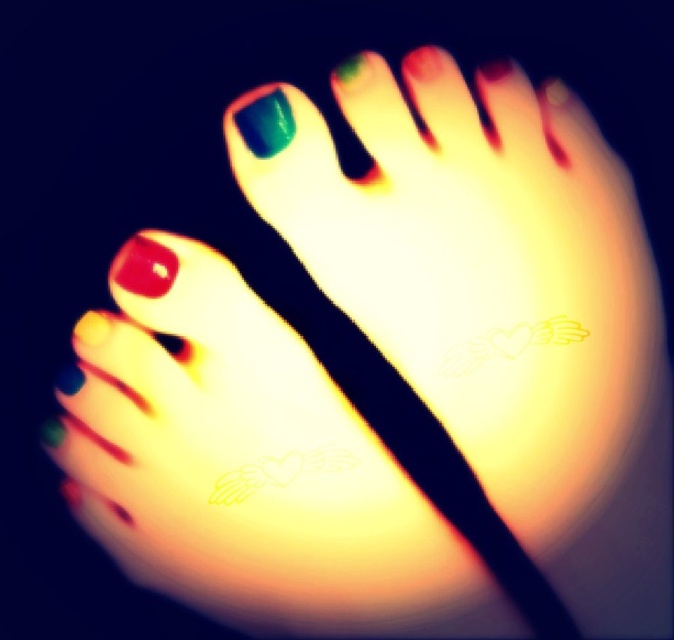
Is matte red nail at center bigger than shiny red nail at lower left?

Indeed, matte red nail at center has a larger size compared to shiny red nail at lower left.

Does matte red nail at center appear under shiny red nail at lower left?

Incorrect, matte red nail at center is not positioned below shiny red nail at lower left.

The image size is (674, 640). What do you see at coordinates (144, 266) in the screenshot?
I see `matte red nail at center` at bounding box center [144, 266].

Where is `matte red nail at center`? The width and height of the screenshot is (674, 640). matte red nail at center is located at coordinates (144, 266).

Is matte red nail at center smaller than green glossy nail at upper center?

Correct, matte red nail at center occupies less space than green glossy nail at upper center.

Which is in front, point (166, 257) or point (266, 157)?

Point (266, 157) is more forward.

The image size is (674, 640). Find the location of `matte red nail at center`. matte red nail at center is located at coordinates (144, 266).

Measure the distance between point (262, 129) and camera.

They are 32.35 inches apart.

Which is below, green glossy nail at upper center or shiny red nail at lower left?

shiny red nail at lower left is below.

Is point (284, 99) in front of point (84, 328)?

Yes, it is in front of point (84, 328).

You are a GUI agent. You are given a task and a screenshot of the screen. Output one action in this format:
    pyautogui.click(x=<x>, y=<y>)
    Task: Click on the green glossy nail at upper center
    The width and height of the screenshot is (674, 640).
    Given the screenshot: What is the action you would take?
    pyautogui.click(x=266, y=124)